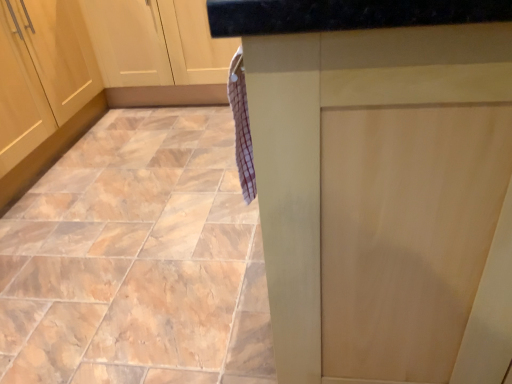
Describe the element at coordinates (382, 184) in the screenshot. I see `matte wood counter at center` at that location.

Locate an element on the screen. matte wood counter at center is located at coordinates (382, 184).

What is the approximate height of marble-like tile at lower left?

1.23 inches.

I want to click on marble-like tile at lower left, so click(137, 260).

What do you see at coordinates (137, 260) in the screenshot? The width and height of the screenshot is (512, 384). I see `marble-like tile at lower left` at bounding box center [137, 260].

The width and height of the screenshot is (512, 384). What are the coordinates of `matte wood counter at center` in the screenshot? It's located at (382, 184).

From the picture: Which is more to the right, matte wood counter at center or marble-like tile at lower left?

Positioned to the right is matte wood counter at center.

Is matte wood counter at center in front of or behind marble-like tile at lower left in the image?

In the image, matte wood counter at center appears in front of marble-like tile at lower left.

Is point (265, 218) less distant than point (83, 364)?

Yes.

From the image's perspective, is matte wood counter at center under marble-like tile at lower left?

Yes.

From a real-world perspective, between matte wood counter at center and marble-like tile at lower left, who is vertically lower?

marble-like tile at lower left.

Considering the sizes of objects matte wood counter at center and marble-like tile at lower left in the image provided, who is thinner, matte wood counter at center or marble-like tile at lower left?

With smaller width is matte wood counter at center.

Considering the sizes of objects matte wood counter at center and marble-like tile at lower left in the image provided, who is taller, matte wood counter at center or marble-like tile at lower left?

matte wood counter at center.

Considering the sizes of objects matte wood counter at center and marble-like tile at lower left in the image provided, who is smaller, matte wood counter at center or marble-like tile at lower left?

Smaller between the two is marble-like tile at lower left.

In the scene shown: Is matte wood counter at center positioned beyond the bounds of marble-like tile at lower left?

Absolutely, matte wood counter at center is external to marble-like tile at lower left.

Is matte wood counter at center touching marble-like tile at lower left?

matte wood counter at center and marble-like tile at lower left are clearly separated.

Does matte wood counter at center turn towards marble-like tile at lower left?

No, matte wood counter at center is not oriented towards marble-like tile at lower left.

From the picture: Can you tell me how much matte wood counter at center and marble-like tile at lower left differ in facing direction?

The angle between the facing direction of matte wood counter at center and the facing direction of marble-like tile at lower left is 90.6 degrees.

Image resolution: width=512 pixels, height=384 pixels. Identify the location of counter above the marble-like tile at lower left (from a real-world perspective). (382, 184).

Is marble-like tile at lower left to the left of matte wood counter at center from the viewer's perspective?

Indeed, marble-like tile at lower left is positioned on the left side of matte wood counter at center.

Does marble-like tile at lower left lie behind matte wood counter at center?

That is True.

Is point (267, 380) farther from camera compared to point (277, 311)?

Yes, point (267, 380) is farther from viewer.

From the image's perspective, is marble-like tile at lower left below matte wood counter at center?

No.

From a real-world perspective, is marble-like tile at lower left physically below matte wood counter at center?

Yes, from a real-world perspective, marble-like tile at lower left is below matte wood counter at center.

Which object is thinner, marble-like tile at lower left or matte wood counter at center?

With smaller width is matte wood counter at center.

Can you confirm if marble-like tile at lower left is shorter than matte wood counter at center?

Yes.

Who is smaller, marble-like tile at lower left or matte wood counter at center?

Smaller between the two is marble-like tile at lower left.

Choose the correct answer: Is marble-like tile at lower left inside matte wood counter at center or outside it?

marble-like tile at lower left is outside matte wood counter at center.

Is marble-like tile at lower left directly adjacent to matte wood counter at center?

They are not placed beside each other.

Is marble-like tile at lower left aimed at matte wood counter at center?

No, marble-like tile at lower left does not turn towards matte wood counter at center.

From the picture: Can you tell me how much marble-like tile at lower left and matte wood counter at center differ in facing direction?

90.6 degrees separate the facing orientations of marble-like tile at lower left and matte wood counter at center.

This screenshot has width=512, height=384. In order to click on ceramic tile above the matte wood counter at center (from the image's perspective) in this screenshot , I will do `click(137, 260)`.

Find the location of a particular element. This screenshot has height=384, width=512. ceramic tile directly beneath the matte wood counter at center (from a real-world perspective) is located at coordinates (137, 260).

Where is `counter lying on the right of marble-like tile at lower left`? The width and height of the screenshot is (512, 384). counter lying on the right of marble-like tile at lower left is located at coordinates (382, 184).